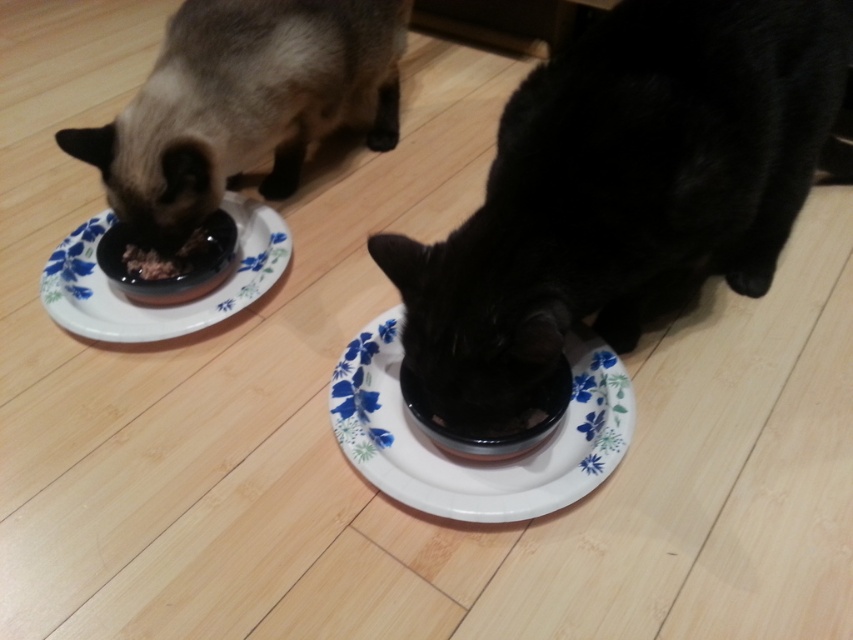
Question: From the image, what is the correct spatial relationship of black glossy bowl at lower center in relation to white floral plate at left?

Choices:
 (A) above
 (B) below

Answer: (A)

Question: Is silky brown fur cat at left bigger than white floral plate at left?

Choices:
 (A) yes
 (B) no

Answer: (A)

Question: Which object appears farthest from the camera in this image?

Choices:
 (A) silky brown fur cat at left
 (B) white floral plate at left
 (C) brown matte food at left
 (D) black glossy bowl at lower center

Answer: (C)

Question: Among these objects, which one is nearest to the camera?

Choices:
 (A) white glossy plate at center
 (B) white floral plate at left

Answer: (A)

Question: Estimate the real-world distances between objects in this image. Which object is closer to the black glossy bowl at lower center?

Choices:
 (A) white floral plate at left
 (B) silky brown fur cat at left
 (C) white glossy plate at center
 (D) brown matte food at left

Answer: (C)

Question: Does black glossy bowl at lower center lie in front of silky brown fur cat at left?

Choices:
 (A) yes
 (B) no

Answer: (A)